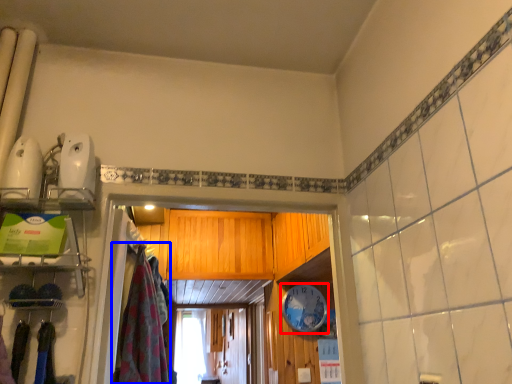
Question: Which point is closer to the camera, clock (highlighted by a red box) or clothing (highlighted by a blue box)?

Choices:
 (A) clock
 (B) clothing

Answer: (B)